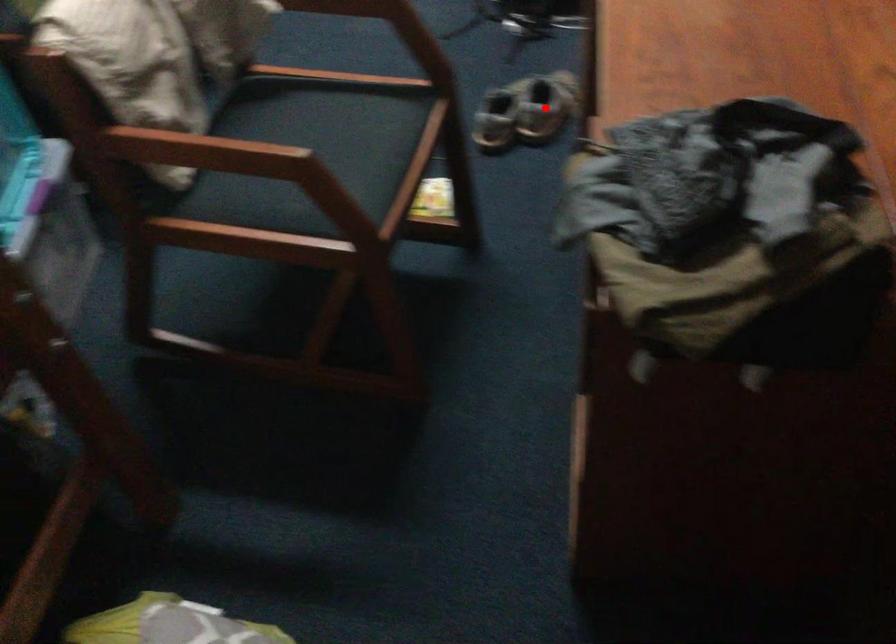
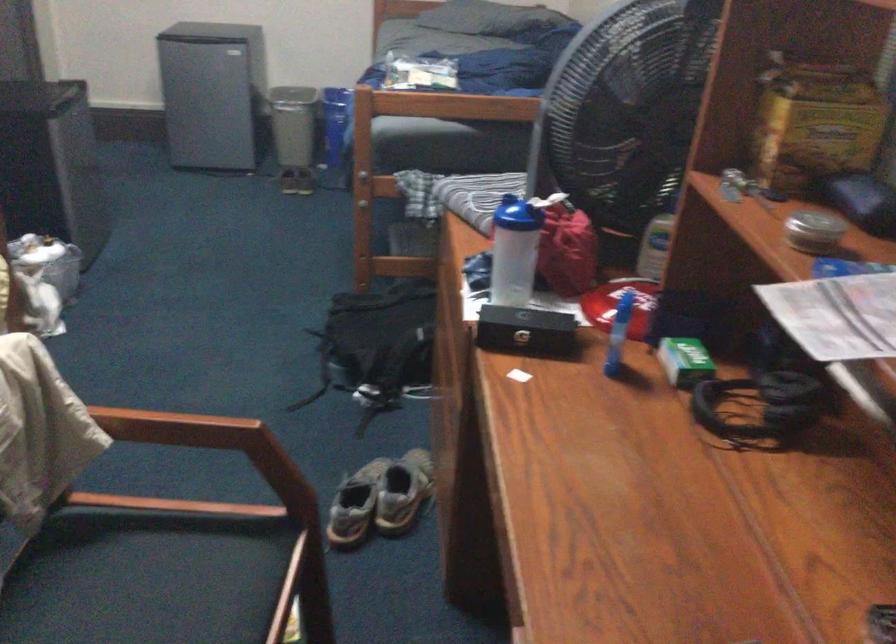
Where in the second image is the point corresponding to the highlighted location from the first image?

(402, 491)